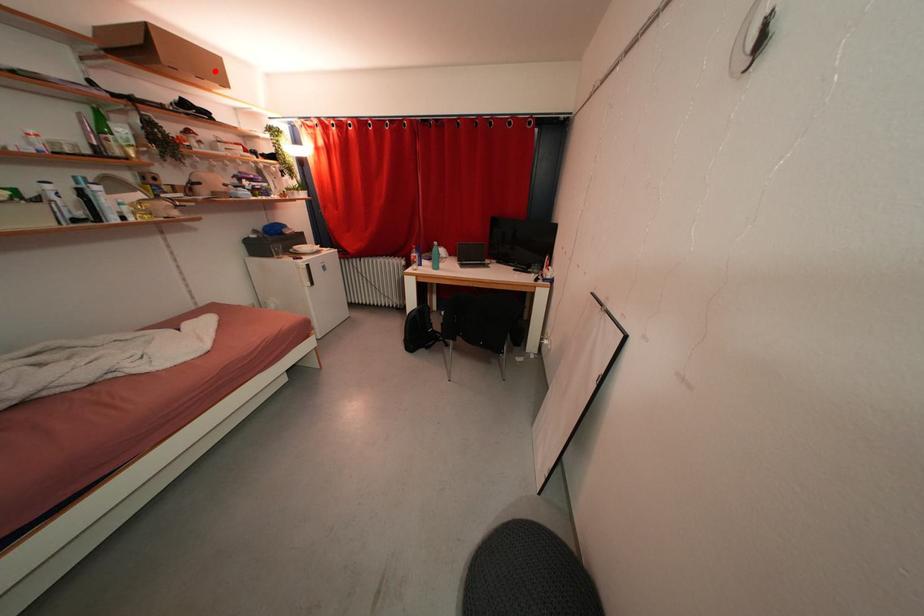
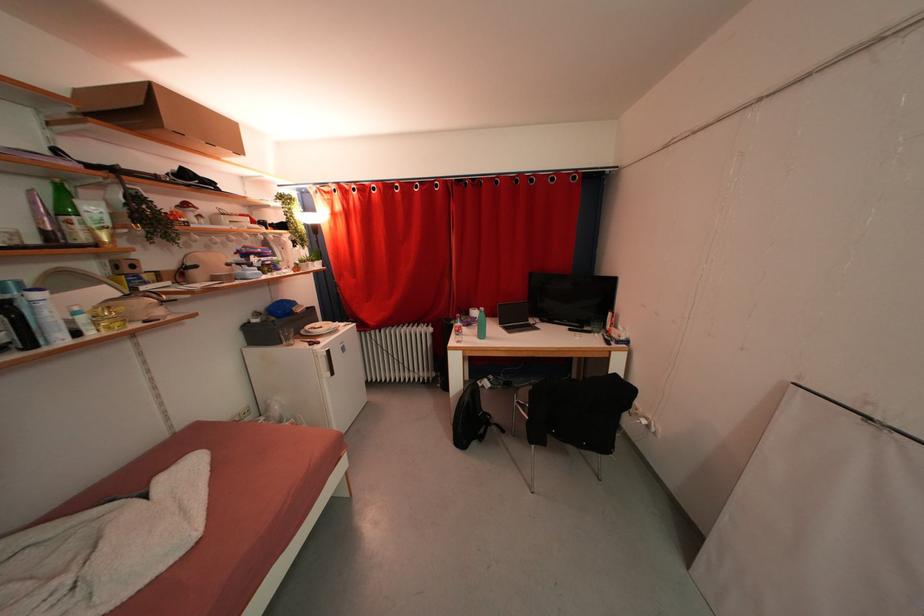
Locate, in the second image, the point that corresponds to the highlighted location in the first image.

(226, 137)